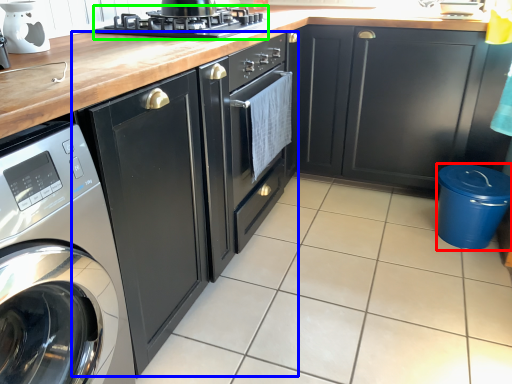
Question: Based on their relative distances, which object is farther from appliance (highlighted by a red box)? Choose from cabinetry (highlighted by a blue box) and kitchen appliance (highlighted by a green box).

Choices:
 (A) cabinetry
 (B) kitchen appliance

Answer: (B)